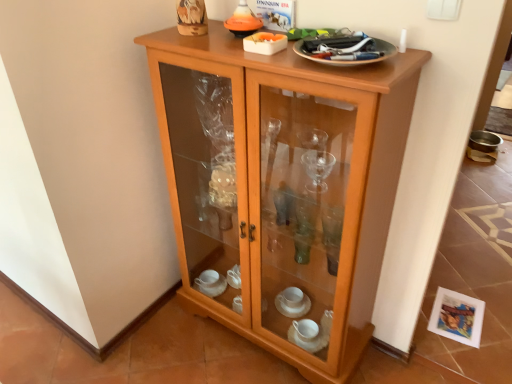
Locate an element on the screen. This screenshot has height=384, width=512. free space to the left of light wood/glass cupboard at center is located at coordinates (168, 345).